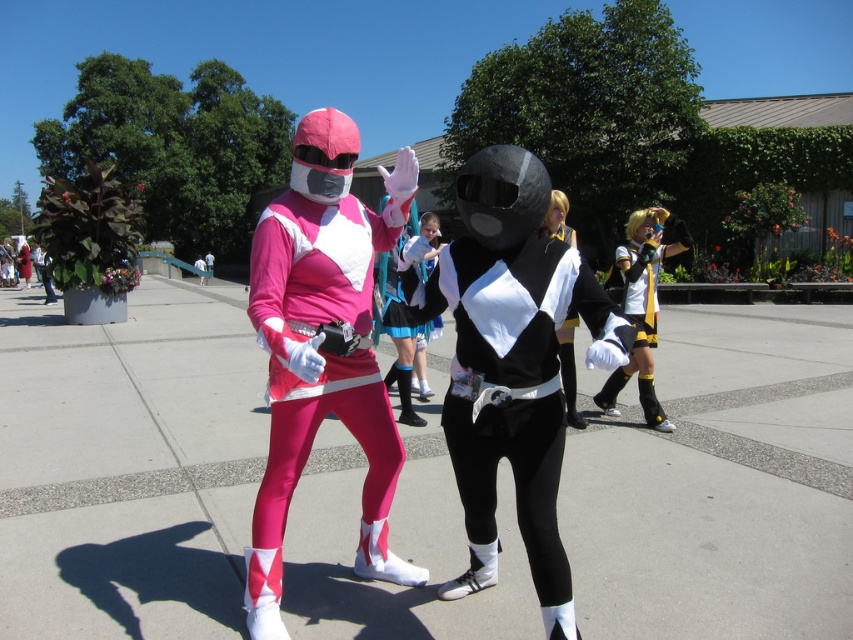
Question: Which object is farther from the camera taking this photo?

Choices:
 (A) black matte/soft material suit at center
 (B) matte black mask at center
 (C) matte pink costume at center
 (D) yellow and black fabric costume at right

Answer: (B)

Question: Does yellow and black fabric costume at right have a lesser width compared to matte black mask at center?

Choices:
 (A) no
 (B) yes

Answer: (A)

Question: Estimate the real-world distances between objects in this image. Which object is closer to the black matte/soft material suit at center?

Choices:
 (A) matte pink costume at center
 (B) matte black mask at center
 (C) yellow and black fabric costume at right

Answer: (A)

Question: Among these points, which one is farthest from the camera?

Choices:
 (A) (553, 218)
 (B) (640, 362)

Answer: (B)

Question: Is matte pink costume at center positioned before yellow and black fabric costume at right?

Choices:
 (A) yes
 (B) no

Answer: (A)

Question: Can you confirm if black matte/soft material suit at center is positioned to the left of yellow and black fabric costume at right?

Choices:
 (A) yes
 (B) no

Answer: (A)